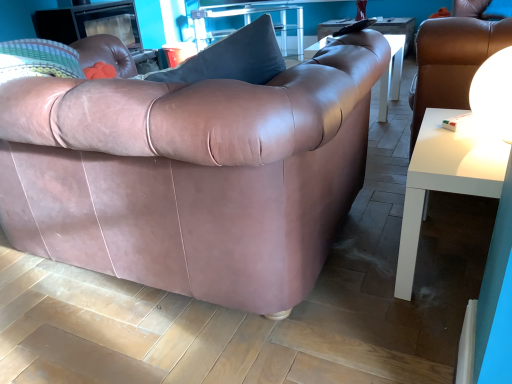
In order to click on vacant location below white glossy table at lower right, marked as the second table in a back-to-front arrangement (from a real-world perspective) in this screenshot , I will do point(448,256).